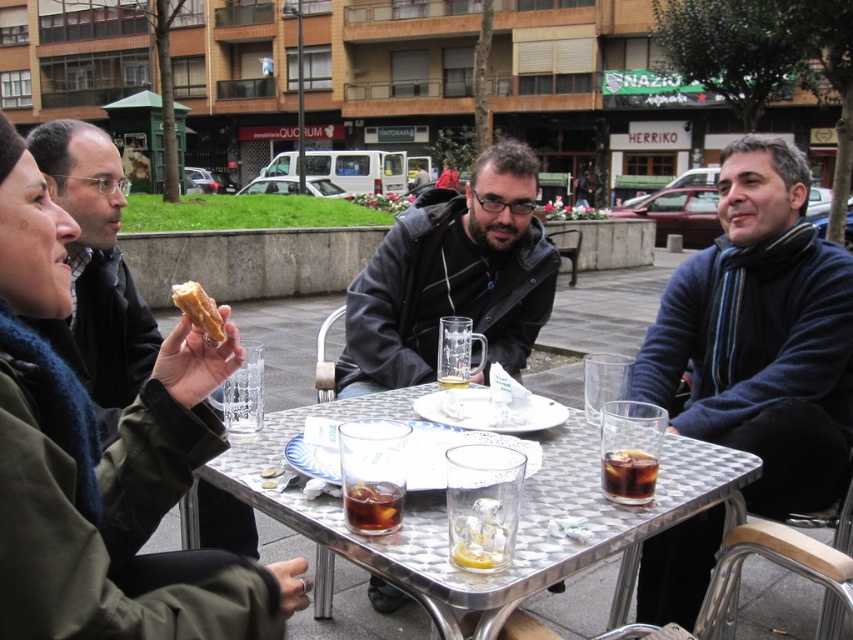
Question: Based on their relative distances, which object is farther from the translucent glass at table center?

Choices:
 (A) dark blue sweater at right
 (B) dark brown glass at table center

Answer: (A)

Question: Observing the image, what is the correct spatial positioning of dark blue sweater at right in reference to dark amber liquid at center?

Choices:
 (A) left
 (B) right

Answer: (B)

Question: Which point appears farthest from the camera in this image?

Choices:
 (A) pyautogui.click(x=608, y=497)
 (B) pyautogui.click(x=780, y=442)

Answer: (B)

Question: Is matte black jacket at center to the right of dark amber liquid at center from the viewer's perspective?

Choices:
 (A) yes
 (B) no

Answer: (A)

Question: Does dark blue sweater at right come in front of matte black jacket at center?

Choices:
 (A) yes
 (B) no

Answer: (A)

Question: Considering the real-world distances, which object is closest to the matte black jacket at center?

Choices:
 (A) dark blue sweater at right
 (B) dark brown glass at table center

Answer: (A)